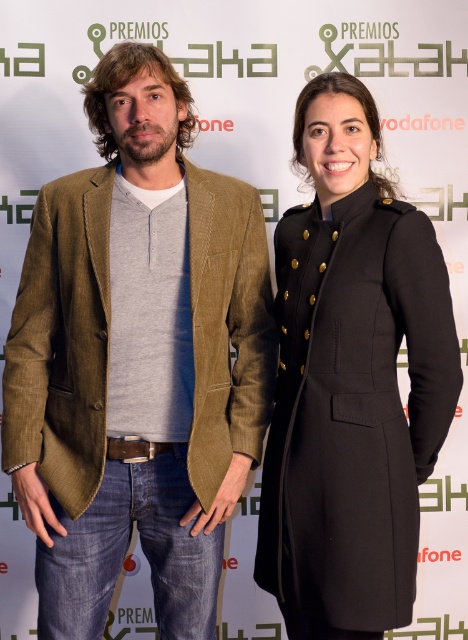
Question: Which point appears closest to the camera in this image?

Choices:
 (A) (392, 620)
 (B) (115, 440)
 (C) (226, 493)

Answer: (A)

Question: Which point is closer to the camera taking this photo?

Choices:
 (A) (292, 445)
 (B) (124, 296)
 (C) (165, 444)

Answer: (A)

Question: Is matte brown blazer at center further to camera compared to brown leather belt at center?

Choices:
 (A) no
 (B) yes

Answer: (A)

Question: Which of the following is the farthest from the observer?

Choices:
 (A) matte brown blazer at center
 (B) black wool coat at center

Answer: (A)

Question: Can you confirm if black wool coat at center is wider than brown leather belt at center?

Choices:
 (A) no
 (B) yes

Answer: (B)

Question: Does black wool coat at center lie in front of brown leather belt at center?

Choices:
 (A) yes
 (B) no

Answer: (A)